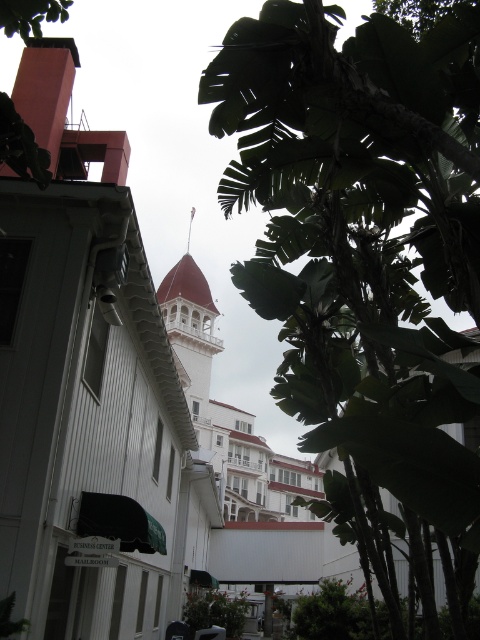
Question: Does green leafy tree at center appear on the left side of green leafy tree at upper center?

Choices:
 (A) no
 (B) yes

Answer: (A)

Question: Which of the following is the farthest from the observer?

Choices:
 (A) (370, 333)
 (B) (20, 1)

Answer: (B)

Question: Among these points, which one is nearest to the camera?

Choices:
 (A) pos(13,22)
 (B) pos(235,600)

Answer: (A)

Question: Does green leafy tree at center have a greater width compared to green leafy plant at lower center?

Choices:
 (A) yes
 (B) no

Answer: (A)

Question: Which object is the farthest from the green leafy tree at center?

Choices:
 (A) green leafy plant at lower center
 (B) green leafy tree at upper center

Answer: (A)

Question: Is green leafy plant at lower center to the right of green leafy tree at upper center from the viewer's perspective?

Choices:
 (A) yes
 (B) no

Answer: (A)